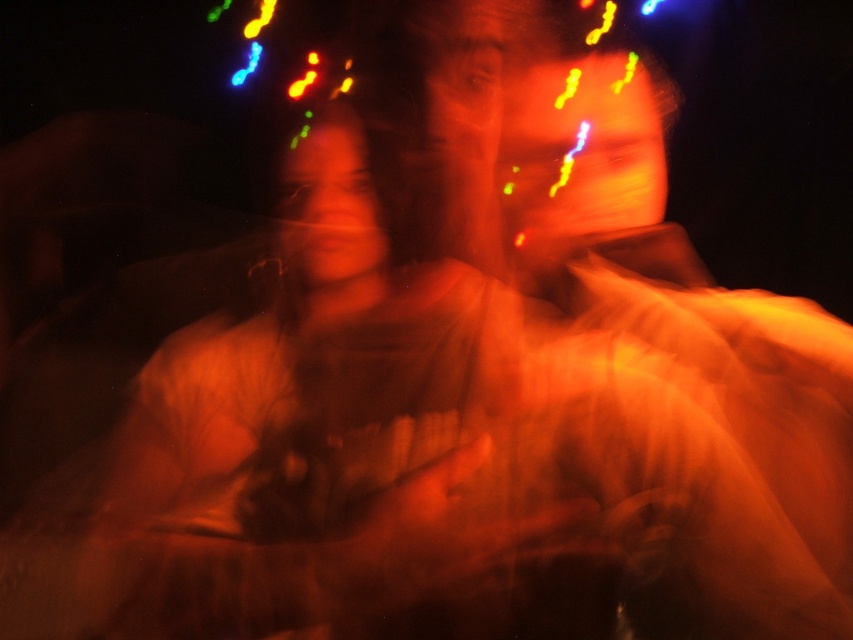
Question: Which of the following is the closest to the observer?

Choices:
 (A) (650, 134)
 (B) (370, 541)
 (C) (317, 150)

Answer: (B)

Question: Is orange matte face at upper center bigger than matte orange face at center?

Choices:
 (A) yes
 (B) no

Answer: (A)

Question: Which point is farther to the camera?

Choices:
 (A) orange matte face at upper center
 (B) matte orange shirt at center

Answer: (A)

Question: Does orange matte face at upper center have a lesser width compared to matte orange face at center?

Choices:
 (A) yes
 (B) no

Answer: (B)

Question: Among these objects, which one is farthest from the camera?

Choices:
 (A) matte orange shirt at center
 (B) matte orange face at center

Answer: (B)

Question: Does matte orange shirt at center appear under matte orange face at center?

Choices:
 (A) yes
 (B) no

Answer: (A)